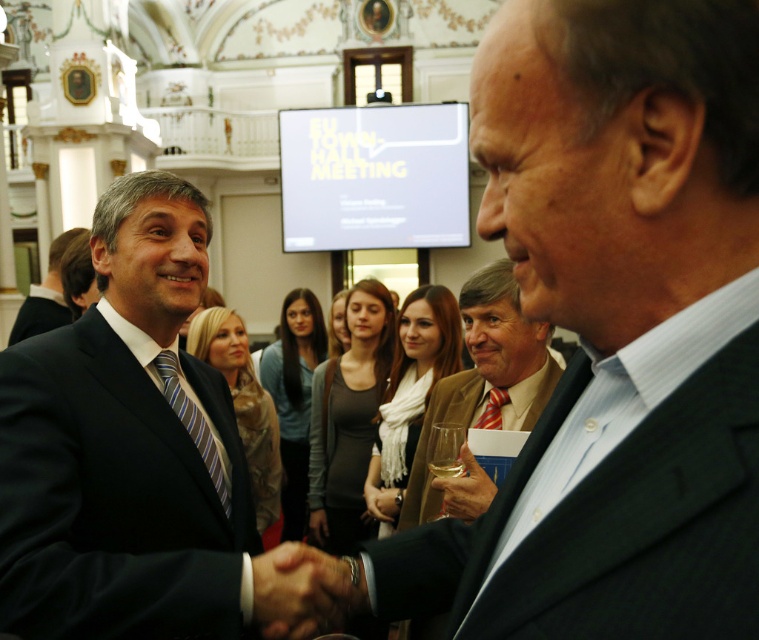
Which is more to the right, matte black suit at center or black matte suit at left?

matte black suit at center

In the scene shown: Who is more distant from viewer, (x=666, y=28) or (x=46, y=292)?

The point (x=46, y=292) is behind.

Is point (463, 580) closer to viewer compared to point (20, 307)?

Yes, it is.

What are the coordinates of `matte black suit at center` in the screenshot? It's located at (613, 332).

Is matte black suit at center above dark blue suit at center?

Indeed, matte black suit at center is positioned over dark blue suit at center.

Can you confirm if matte black suit at center is positioned below dark blue suit at center?

Incorrect, matte black suit at center is not positioned below dark blue suit at center.

The height and width of the screenshot is (640, 759). Identify the location of matte black suit at center. (613, 332).

Is matte black suit at center to the right of dark gray suit at center from the viewer's perspective?

Yes, matte black suit at center is to the right of dark gray suit at center.

Does matte black suit at center have a lesser width compared to dark gray suit at center?

Incorrect, matte black suit at center's width is not less than dark gray suit at center's.

You are a GUI agent. You are given a task and a screenshot of the screen. Output one action in this format:
    pyautogui.click(x=<x>, y=<y>)
    Task: Click on the matte black suit at center
    This screenshot has width=759, height=640.
    Given the screenshot: What is the action you would take?
    pyautogui.click(x=613, y=332)